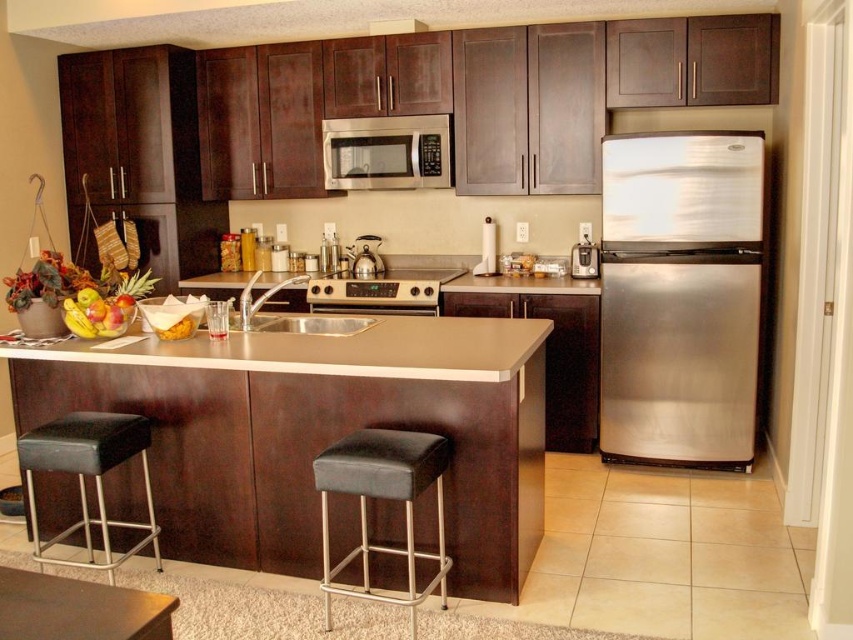
You are a kitchen designer planning to install a new appliance. You need to know the spatial relationship between the stainless steel refrigerator at right and the stainless steel toaster at center. Which appliance is located below the other?

The stainless steel refrigerator at right is positioned under the stainless steel toaster at center, meaning the refrigerator is below the toaster.

You are standing in the kitchen and want to reach both the point at coordinates point (125, 349) and the point at coordinates point (442, 602). Which point will you reach first?

You will reach point (125, 349) first because it is closer to you than point (442, 602), which is further away.